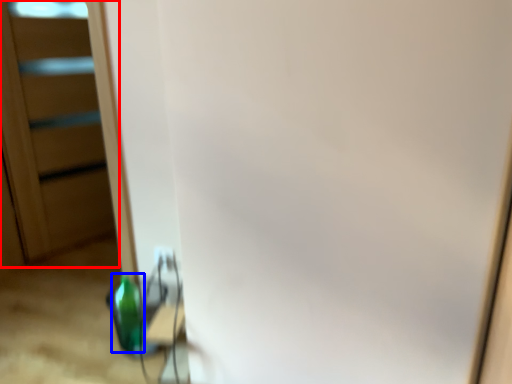
Question: Which point is further to the camera, screen door (highlighted by a red box) or bottle (highlighted by a blue box)?

Choices:
 (A) screen door
 (B) bottle

Answer: (A)